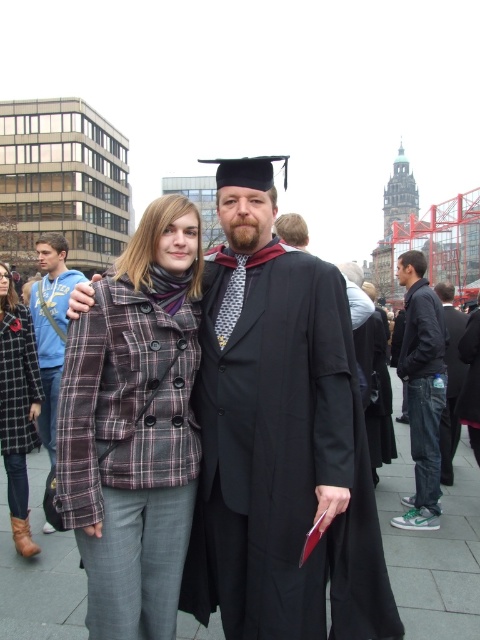
Question: Is plaid fabric coat at center positioned behind dark gray jeans at lower right?

Choices:
 (A) no
 (B) yes

Answer: (A)

Question: Estimate the real-world distances between objects in this image. Which object is farther from the plaid fabric jacket at center?

Choices:
 (A) plaid wool coat at center
 (B) dark blue jeans at center
 (C) dark gray jeans at lower right

Answer: (C)

Question: Can you confirm if plaid fabric jacket at center is positioned above plaid fabric coat at center?

Choices:
 (A) no
 (B) yes

Answer: (B)

Question: Which point is farther to the camera?

Choices:
 (A) plaid fabric coat at center
 (B) plaid fabric coat at left

Answer: (B)

Question: Which of the following is the farthest from the observer?

Choices:
 (A) (453, 480)
 (B) (213, 490)

Answer: (A)

Question: Is plaid fabric coat at center wider than dark blue jeans at center?

Choices:
 (A) yes
 (B) no

Answer: (A)